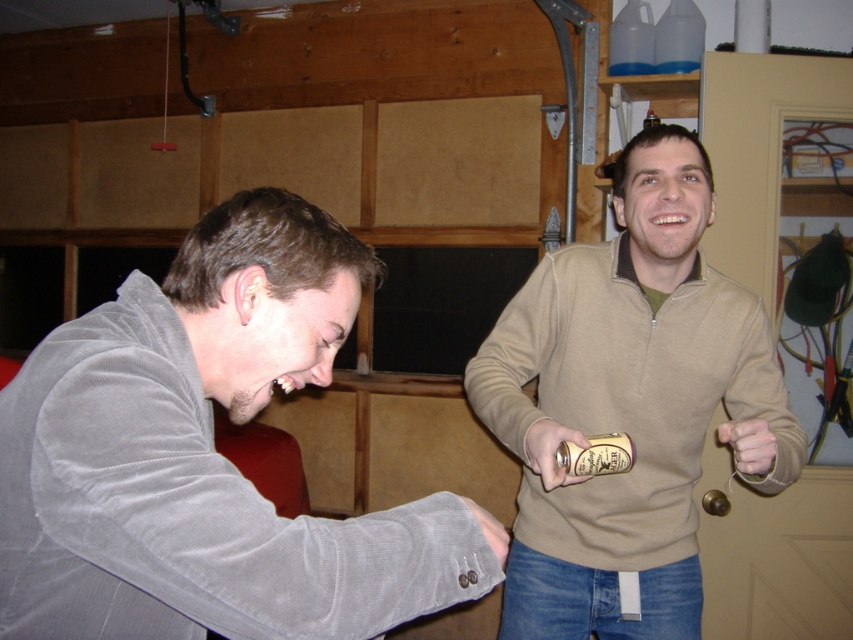
Can you confirm if metallic gold can at right is thinner than matte beige hand at lower right?

Correct, metallic gold can at right's width is less than matte beige hand at lower right's.

Find the location of `metallic gold can at right`. metallic gold can at right is located at coordinates pyautogui.click(x=550, y=451).

Between point (550, 438) and point (758, 449), which one is positioned behind?

The point (550, 438) is behind.

Where is `metallic gold can at right`? The height and width of the screenshot is (640, 853). metallic gold can at right is located at coordinates (550, 451).

Can you confirm if metallic gold can at right is positioned to the left of gray corduroy hand at lower left?

Incorrect, metallic gold can at right is not on the left side of gray corduroy hand at lower left.

Is metallic gold can at right thinner than gray corduroy hand at lower left?

In fact, metallic gold can at right might be wider than gray corduroy hand at lower left.

Is point (543, 464) in front of point (492, 540)?

No, (543, 464) is further to viewer.

Locate an element on the screen. This screenshot has height=640, width=853. metallic gold can at right is located at coordinates (550, 451).

Between velvet gray jacket at left and metallic gold can at right, which one has more height?

velvet gray jacket at left

Which is in front, point (218, 244) or point (544, 424)?

Point (218, 244)

The width and height of the screenshot is (853, 640). What do you see at coordinates (206, 456) in the screenshot? I see `velvet gray jacket at left` at bounding box center [206, 456].

Locate an element on the screen. Image resolution: width=853 pixels, height=640 pixels. velvet gray jacket at left is located at coordinates (206, 456).